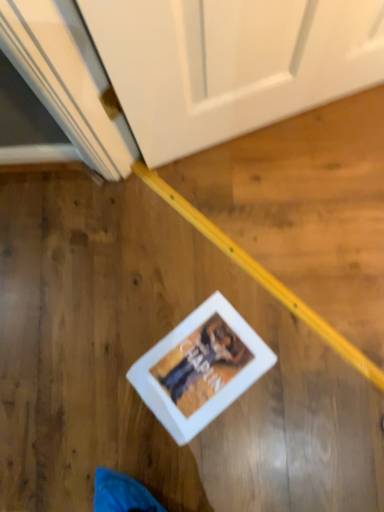
Question: Should I look upward or downward to see white matte picture frame at lower center?

Choices:
 (A) up
 (B) down

Answer: (B)